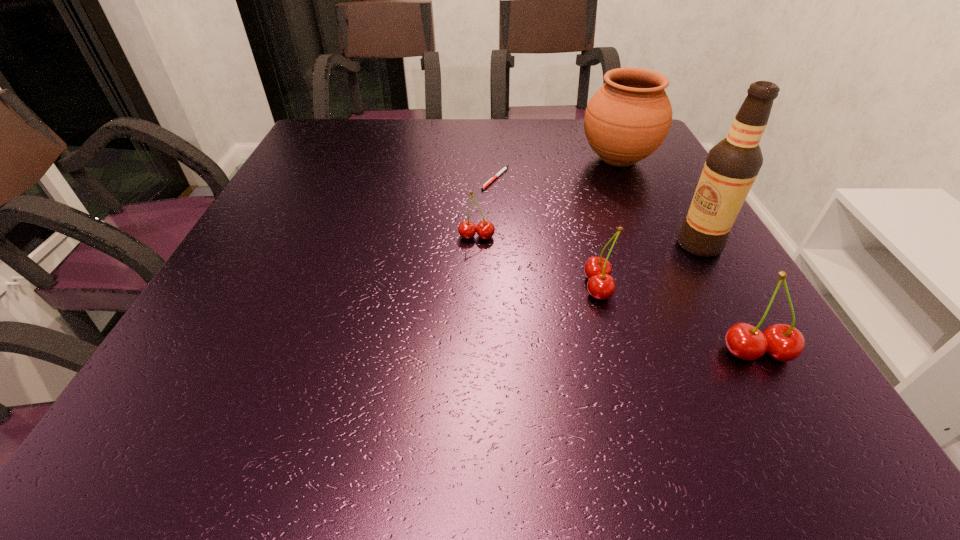
Locate an element on the screen. The width and height of the screenshot is (960, 540). the leftmost cherry is located at coordinates (467, 229).

This screenshot has width=960, height=540. Find the location of `the farthest cherry`. the farthest cherry is located at coordinates click(x=467, y=229).

Find the location of a particular element. This screenshot has width=960, height=540. the third shortest object is located at coordinates (601, 286).

The image size is (960, 540). What are the coordinates of `the second farthest cherry` in the screenshot? It's located at (601, 286).

Image resolution: width=960 pixels, height=540 pixels. I want to click on the nearest cherry, so click(x=784, y=343).

Where is `the tallest cherry`? the tallest cherry is located at coordinates (784, 343).

Find the location of `pottery`. pottery is located at coordinates coord(628,118).

Where is `the shortest object`? the shortest object is located at coordinates [x=499, y=173].

Where is `alcohol`? alcohol is located at coordinates [732, 165].

Locate an element on the screen. This screenshot has width=960, height=540. vacant space located with the stems of the second shortest object pointing upwards is located at coordinates [x=475, y=375].